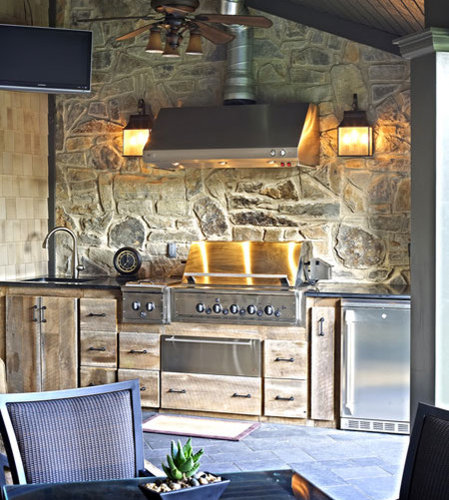
Image resolution: width=449 pixels, height=500 pixels. Find the location of `sink`. sink is located at coordinates (70, 280).